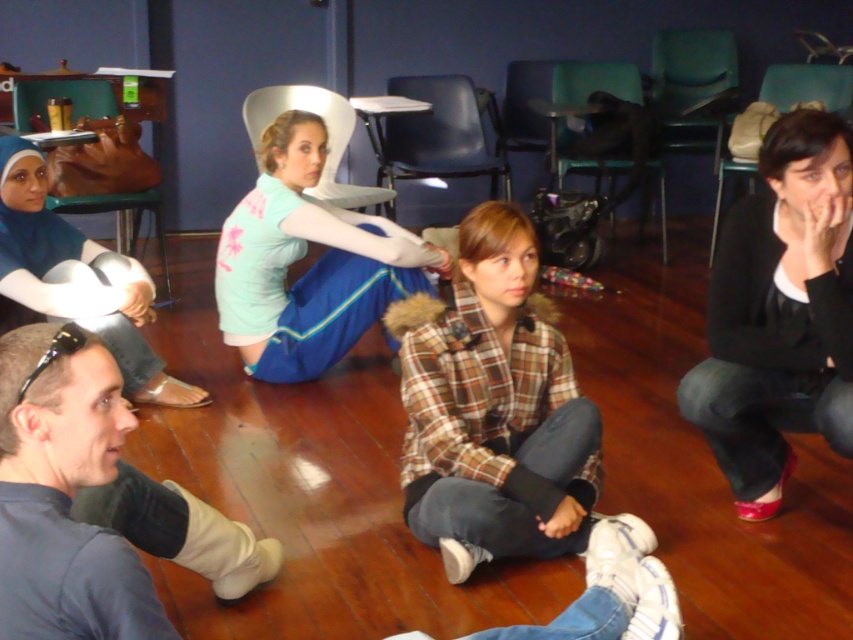
You are organizing a clothing donation drive and need to determine if the black matte sweater at lower right and the dark blue shirt at lower left can fit into a standard donation box that has a maximum capacity of 30 liters. Which item takes up more space?

The black matte sweater at lower right is bigger than the dark blue shirt at lower left, so it takes up more space and would require a larger box. However, since the question is about fitting into a 30L box, both items might fit depending on their exact sizes, but the sweater occupies more space than the shirt.

You are standing in the classroom and need to reach the black matte sweater at lower right. Is the blue denim jeans at lower center blocking your path? Explain why or why not.

The blue denim jeans at lower center is below the black matte sweater at lower right, so the jeans are positioned lower and not directly in front of the sweater. Therefore, the blue denim jeans at lower center is not blocking the path to the black matte sweater at lower right.